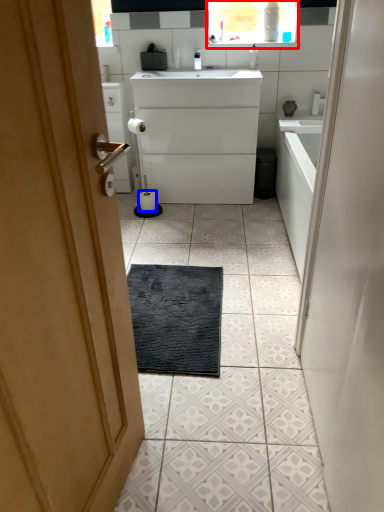
Question: Among these objects, which one is nearest to the camera, medicine cabinet (highlighted by a red box) or toilet paper (highlighted by a blue box)?

Choices:
 (A) medicine cabinet
 (B) toilet paper

Answer: (A)